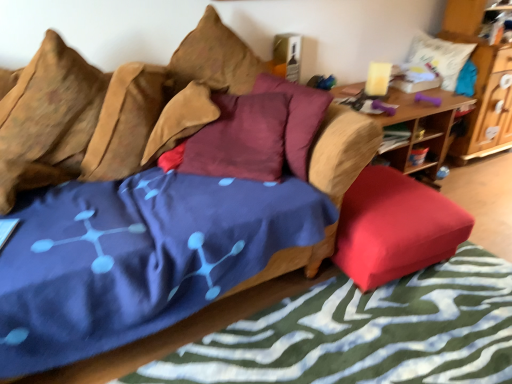
Question: Considering the positions of wooden table at right and textured brown pillow at upper left, marked as the first pillow in a left-to-right arrangement, in the image, is wooden table at right bigger or smaller than textured brown pillow at upper left, marked as the first pillow in a left-to-right arrangement,?

Choices:
 (A) small
 (B) big

Answer: (B)

Question: From a real-world perspective, is wooden table at right physically located above or below textured brown pillow at upper left, marked as the first pillow in a left-to-right arrangement?

Choices:
 (A) above
 (B) below

Answer: (B)

Question: Estimate the real-world distances between objects in this image. Which object is farther from the red fabric ottoman at lower right?

Choices:
 (A) white soft pillow at upper right, which appears as the 4th pillow when viewed from the left
 (B) blue fabric mattress at center
 (C) textured brown pillow at upper left, acting as the fourth pillow starting from the right
 (D) blue fabric bed frame at lower left
 (E) maroon fabric pillow at center, which is the third pillow from left to right

Answer: (A)

Question: Which of these objects is positioned closest to the red fabric ottoman at lower right?

Choices:
 (A) white soft pillow at upper right, which appears as the 4th pillow when viewed from the left
 (B) blue fabric bed frame at lower left
 (C) velvet-like brown couch at center
 (D) wooden table at right
 (E) wooden cabinet at upper right

Answer: (B)